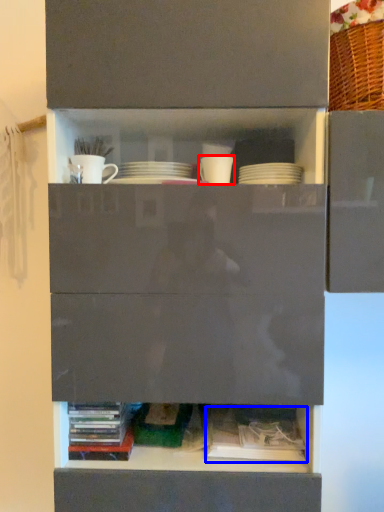
Question: Which point is closer to the camera, tableware (highlighted by a red box) or book (highlighted by a blue box)?

Choices:
 (A) tableware
 (B) book

Answer: (B)